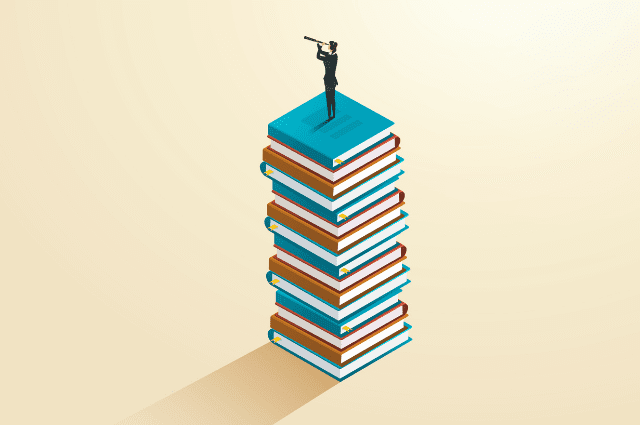
Identify the location of brown book. The height and width of the screenshot is (425, 640). (323, 348), (324, 335), (329, 290), (328, 280), (329, 243), (321, 226), (324, 190), (328, 173).